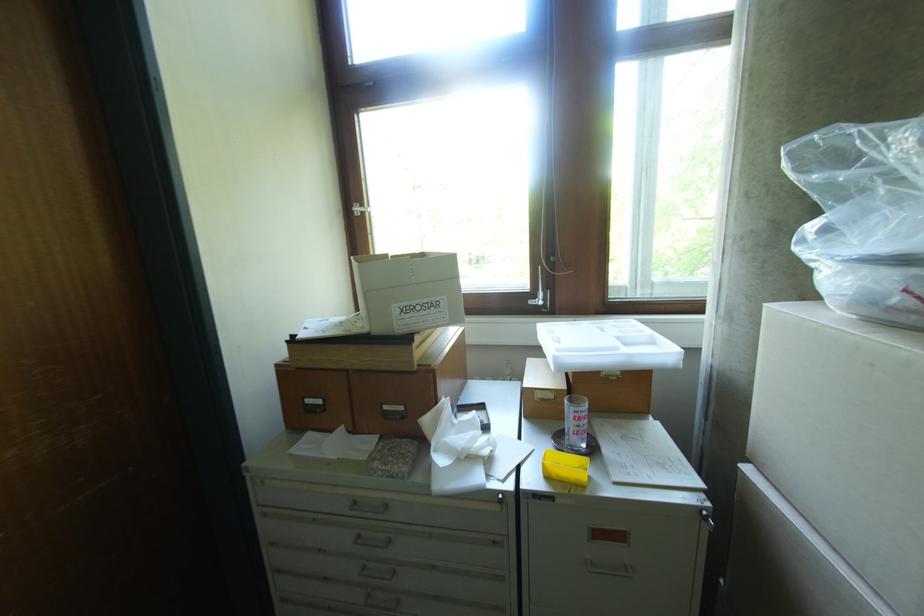
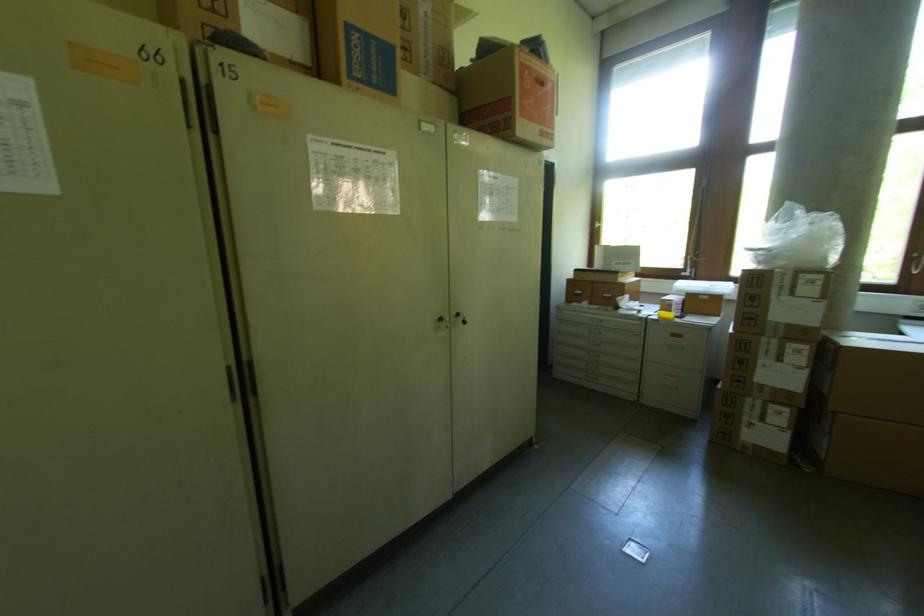
The point at (590,422) is marked in the first image. Where is the corresponding point in the second image?

(684, 308)